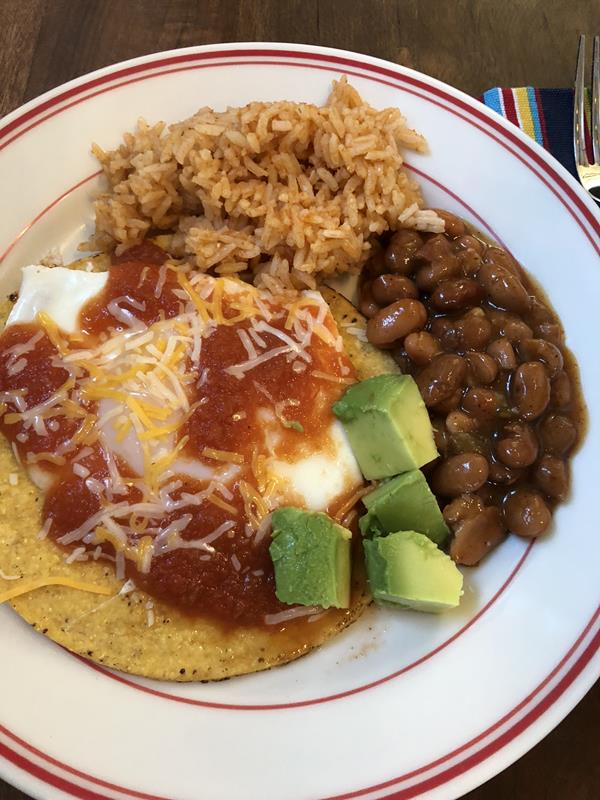
At what (x,y) coordinates should I click in order to perform the action: click on plate. Please return your answer as a coordinate pair (x, y). This screenshot has height=800, width=600. Looking at the image, I should click on (390, 725).